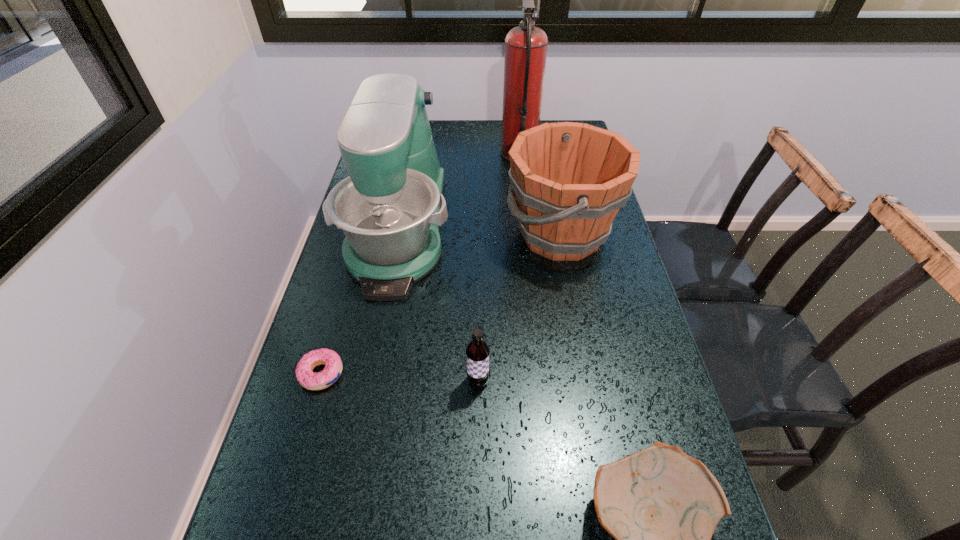
Identify the location of free spot located 0.250m on the front-facing side of the second tallest object. This screenshot has height=540, width=960. (366, 393).

Identify the location of free location located on the handle side of the bucket. (403, 234).

Find the location of `free space located 0.320m on the handle side of the bucket`. free space located 0.320m on the handle side of the bucket is located at coordinates (393, 234).

Where is `blank space located 0.340m on the handle side of the bucket`? blank space located 0.340m on the handle side of the bucket is located at coordinates (385, 234).

Identify the location of vacant region located 0.370m on the back of the root beer. This screenshot has height=540, width=960. (478, 254).

Where is `free spot located 0.290m on the right of the doughnut`? The image size is (960, 540). free spot located 0.290m on the right of the doughnut is located at coordinates (479, 374).

Where is `object at the far edge`? The image size is (960, 540). object at the far edge is located at coordinates (526, 45).

Locate an element on the screen. The width and height of the screenshot is (960, 540). mixer that is at the left edge is located at coordinates (390, 208).

You are a GUI agent. You are given a task and a screenshot of the screen. Output one action in this format:
    pyautogui.click(x=<x>, y=<y>)
    Task: Click on the doughnut at the left edge
    The height and width of the screenshot is (540, 960).
    Given the screenshot: What is the action you would take?
    pyautogui.click(x=307, y=378)

Where is `object located at the right edge`? This screenshot has height=540, width=960. object located at the right edge is located at coordinates (570, 179).